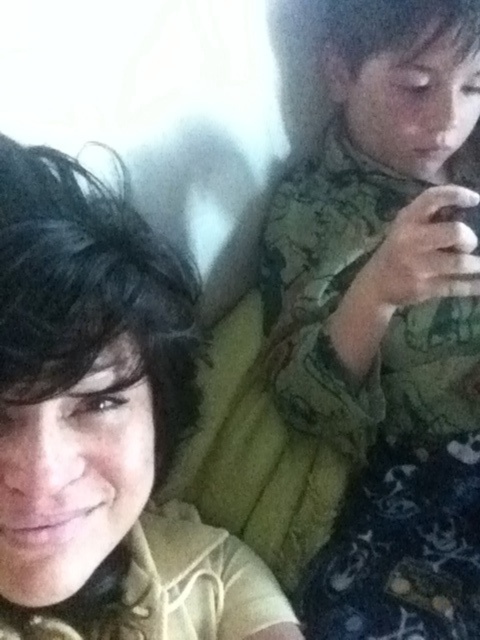
Question: Is camouflage fabric shirt at upper right to the right of matte yellow shirt at center from the viewer's perspective?

Choices:
 (A) yes
 (B) no

Answer: (A)

Question: Which point is farther to the camera?

Choices:
 (A) yellow fabric pillow at center
 (B) matte yellow shirt at center
 (C) camouflage fabric shirt at upper right

Answer: (A)

Question: Which point is farther from the camera taking this photo?

Choices:
 (A) (1, 545)
 (B) (421, 556)
 (C) (196, 442)

Answer: (C)

Question: Which of the following is the closest to the observer?

Choices:
 (A) (212, 541)
 (B) (416, 180)
 (C) (292, 579)

Answer: (A)

Question: Does camouflage fabric shirt at upper right lie behind matte yellow shirt at center?

Choices:
 (A) yes
 (B) no

Answer: (A)

Question: Where is camouflage fabric shirt at upper right located in relation to yellow fabric pillow at center in the image?

Choices:
 (A) below
 (B) above

Answer: (B)